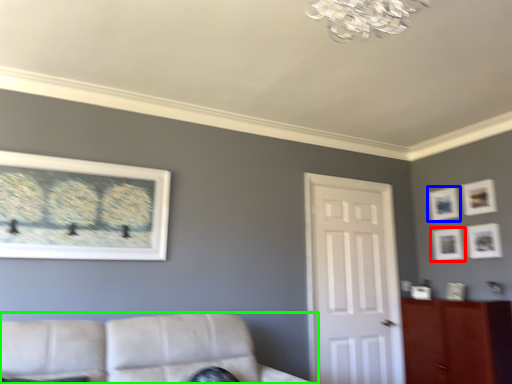
Question: Which is farther away from picture frame (highlighted by a red box)? picture frame (highlighted by a blue box) or studio couch (highlighted by a green box)?

Choices:
 (A) picture frame
 (B) studio couch

Answer: (B)